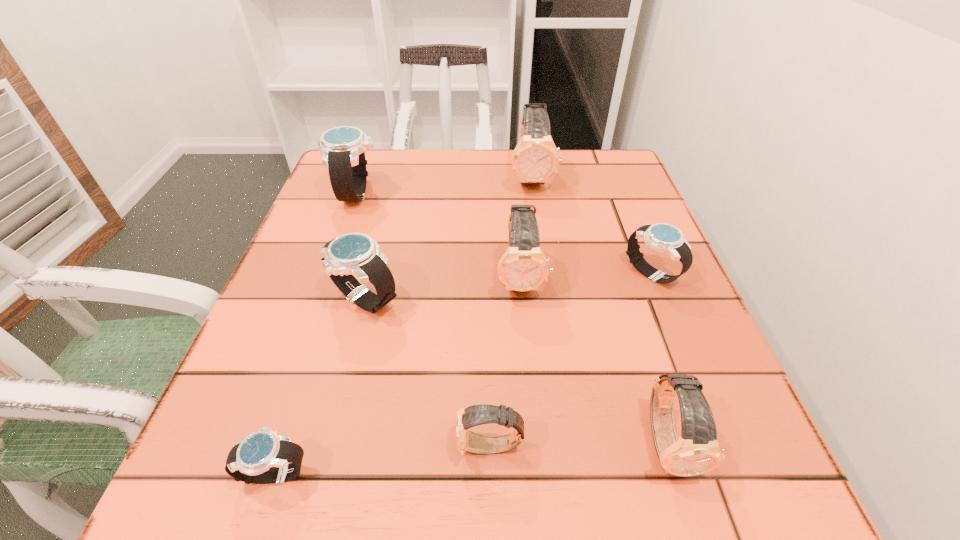
The height and width of the screenshot is (540, 960). In order to click on vacant space located 0.050m on the face of the tallest watch in this screenshot , I will do `click(537, 210)`.

Locate an element on the screen. The image size is (960, 540). vacant space positioned 0.070m on the back of the biggest silver watch is located at coordinates (370, 160).

Where is `free spot located on the face of the second biggest gold watch`? This screenshot has height=540, width=960. free spot located on the face of the second biggest gold watch is located at coordinates (536, 442).

Where is `vacant space located on the right of the second biggest silver watch`? Image resolution: width=960 pixels, height=540 pixels. vacant space located on the right of the second biggest silver watch is located at coordinates (560, 299).

At what (x,y) coordinates should I click in order to perform the action: click on blank area located 0.290m on the back of the rightmost silver watch. Please return your answer as a coordinate pair (x, y). The width and height of the screenshot is (960, 540). Looking at the image, I should click on (612, 179).

Where is `vacant space located on the face of the smallest gold watch`? The height and width of the screenshot is (540, 960). vacant space located on the face of the smallest gold watch is located at coordinates (242, 447).

Where is `vacant region located on the face of the smallest gold watch`? This screenshot has width=960, height=540. vacant region located on the face of the smallest gold watch is located at coordinates (234, 447).

This screenshot has width=960, height=540. I want to click on free space located on the face of the smallest gold watch, so click(234, 447).

The image size is (960, 540). I want to click on vacant space situated 0.090m on the right of the shortest object, so click(378, 472).

The width and height of the screenshot is (960, 540). In order to click on object that is at the far left corner in this screenshot , I will do `click(343, 148)`.